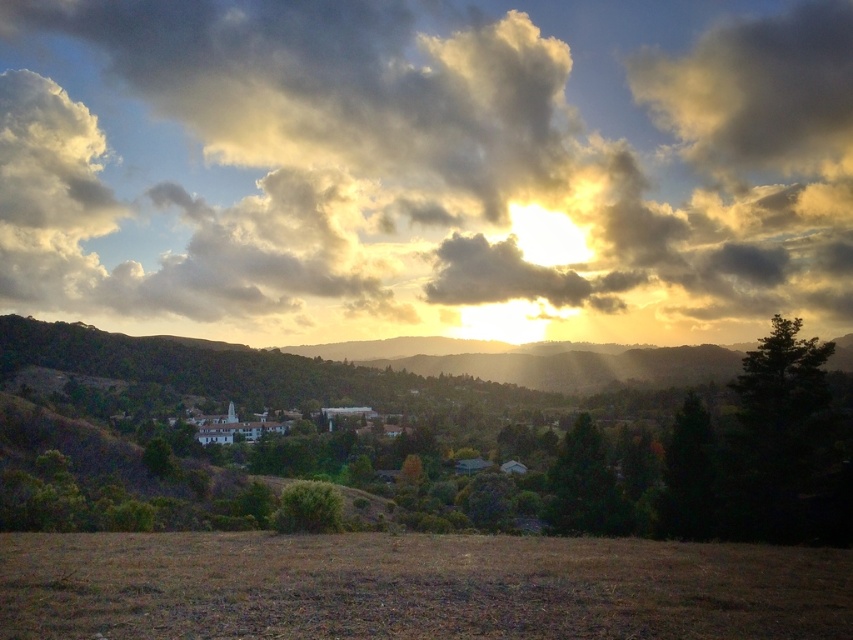
Is point (805, 224) behind point (218, 349)?

Yes, point (805, 224) is farther from viewer.

Is point (51, 305) closer to camera compared to point (428, 384)?

No, (51, 305) is further to viewer.

I want to click on cloudy sky at upper center, so click(427, 168).

Which is in front, point (143, 388) or point (756, 465)?

Point (756, 465) is in front.

Consider the image. Can you confirm if green leafy tree at center is positioned to the right of dark green leafy tree at right?

In fact, green leafy tree at center is to the left of dark green leafy tree at right.

Is point (693, 384) more distant than point (747, 525)?

Yes.

Where is `green leafy tree at center`? The image size is (853, 640). green leafy tree at center is located at coordinates (485, 429).

Does green leafy tree at center have a lesser height compared to brown grass at lower center?

In fact, green leafy tree at center may be taller than brown grass at lower center.

Does green leafy tree at center have a smaller size compared to brown grass at lower center?

Incorrect, green leafy tree at center is not smaller in size than brown grass at lower center.

This screenshot has height=640, width=853. Describe the element at coordinates (485, 429) in the screenshot. I see `green leafy tree at center` at that location.

This screenshot has height=640, width=853. In order to click on green leafy tree at center in this screenshot , I will do `click(485, 429)`.